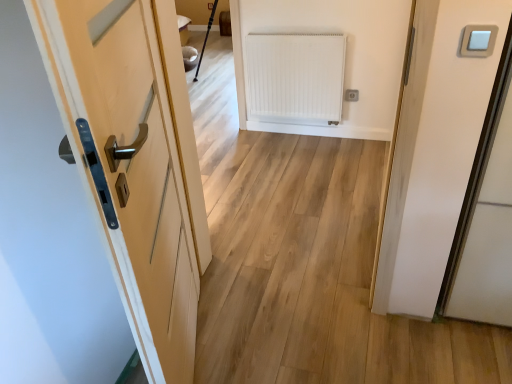
Question: Is white plastic light switch at upper right outside of white plastic electric outlet at upper right?

Choices:
 (A) yes
 (B) no

Answer: (A)

Question: Is white plastic light switch at upper right aimed at white plastic electric outlet at upper right?

Choices:
 (A) yes
 (B) no

Answer: (B)

Question: Is white plastic light switch at upper right positioned with its back to white plastic electric outlet at upper right?

Choices:
 (A) yes
 (B) no

Answer: (B)

Question: From the image's perspective, is white plastic light switch at upper right below white plastic electric outlet at upper right?

Choices:
 (A) no
 (B) yes

Answer: (B)

Question: Is white plastic light switch at upper right directly adjacent to white plastic electric outlet at upper right?

Choices:
 (A) yes
 (B) no

Answer: (B)

Question: Is white plastic light switch at upper right further to the viewer compared to white plastic electric outlet at upper right?

Choices:
 (A) yes
 (B) no

Answer: (B)

Question: Considering the relative sizes of matte wood door at left and white matte radiator at center in the image provided, is matte wood door at left thinner than white matte radiator at center?

Choices:
 (A) no
 (B) yes

Answer: (A)

Question: Considering the relative sizes of matte wood door at left and white matte radiator at center in the image provided, is matte wood door at left taller than white matte radiator at center?

Choices:
 (A) yes
 (B) no

Answer: (A)

Question: From a real-world perspective, is matte wood door at left below white matte radiator at center?

Choices:
 (A) no
 (B) yes

Answer: (A)

Question: From the image's perspective, is matte wood door at left located beneath white matte radiator at center?

Choices:
 (A) yes
 (B) no

Answer: (A)

Question: Considering the relative sizes of matte wood door at left and white matte radiator at center in the image provided, is matte wood door at left bigger than white matte radiator at center?

Choices:
 (A) no
 (B) yes

Answer: (B)

Question: Is matte wood door at left facing away from white matte radiator at center?

Choices:
 (A) yes
 (B) no

Answer: (B)

Question: Does white matte radiator at center have a greater width compared to white plastic light switch at upper right?

Choices:
 (A) no
 (B) yes

Answer: (B)